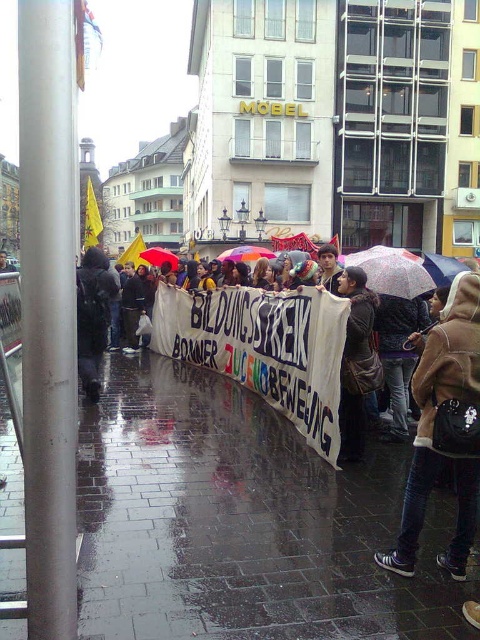
You are standing at the center of the image. In which direction should you move to reach the brown fuzzy coat at lower right?

You should move towards the lower right direction to reach the brown fuzzy coat at lower right.

You are standing at the point marked by the coordinates (241,522). What type of surface are you currently standing on?

The point marked by the coordinates (241,522) is on wet brick pavement at lower center.